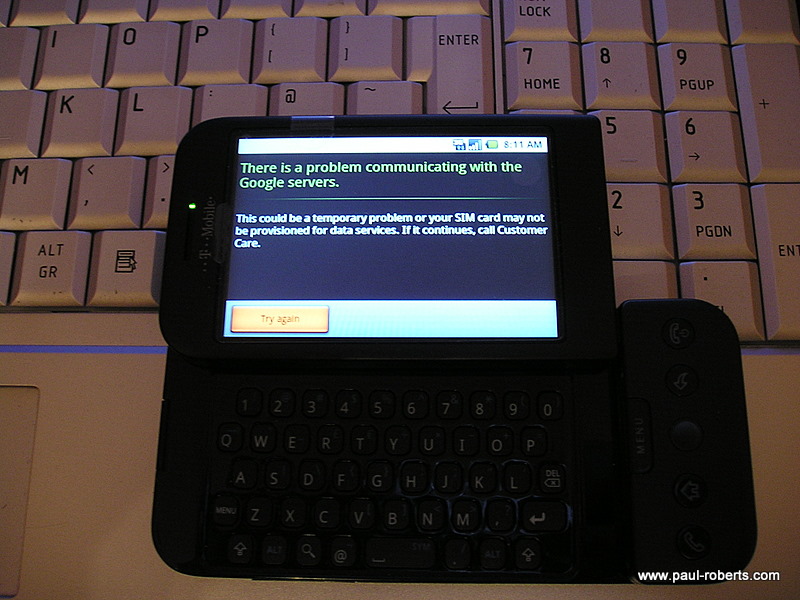
Image resolution: width=800 pixels, height=600 pixels. In order to click on phone in this screenshot , I will do `click(598, 415)`.